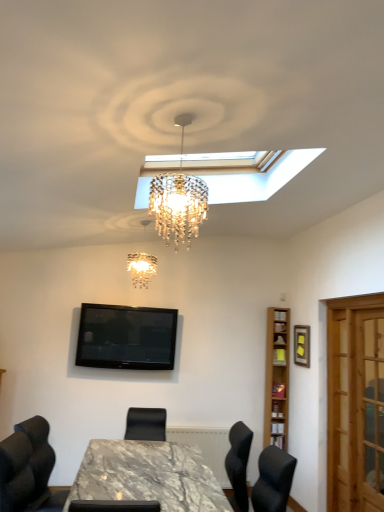
Describe the element at coordinates (355, 403) in the screenshot. This screenshot has width=384, height=512. I see `wooden screen door at right` at that location.

Find the location of a particular element. wooden screen door at right is located at coordinates (355, 403).

What are the coordinates of `marble table at center` in the screenshot? It's located at (148, 476).

Identify the location of wooden screen door at right. This screenshot has width=384, height=512. (355, 403).

In terms of height, does black glossy tv at upper center look taller or shorter compared to wooden screen door at right?

Clearly, black glossy tv at upper center is shorter compared to wooden screen door at right.

From the image's perspective, which is below, black glossy tv at upper center or wooden screen door at right?

wooden screen door at right.

Locate an element on the screen. television that is above the wooden screen door at right (from the image's perspective) is located at coordinates click(126, 337).

Considering the positions of objects black glossy tv at upper center and wooden screen door at right in the image provided, who is more to the right, black glossy tv at upper center or wooden screen door at right?

wooden screen door at right is more to the right.

Locate an element on the screen. The height and width of the screenshot is (512, 384). screen door located below the light brown wooden bookshelf at right (from the image's perspective) is located at coordinates (355, 403).

Based on their sizes in the image, would you say light brown wooden bookshelf at right is bigger or smaller than wooden screen door at right?

light brown wooden bookshelf at right is smaller than wooden screen door at right.

Is point (275, 398) behind point (357, 403)?

Yes, it is.

Consider the image. Does wooden screen door at right have a lesser height compared to black glossy tv at upper center?

In fact, wooden screen door at right may be taller than black glossy tv at upper center.

Does wooden screen door at right appear on the left side of black glossy tv at upper center?

→ Incorrect, wooden screen door at right is not on the left side of black glossy tv at upper center.

Can we say wooden screen door at right lies outside black glossy tv at upper center?

Yes, wooden screen door at right is not within black glossy tv at upper center.

From the image's perspective, between wooden screen door at right and black glossy tv at upper center, who is located below?

wooden screen door at right, from the image's perspective.

At what (x,y) coordinates should I click in order to perform the action: click on lamp behind the wooden screen door at right. Please return your answer as a coordinate pair (x, y). Looking at the image, I should click on (141, 268).

Between crystal chandelier at center and wooden screen door at right, which one is positioned in front?

wooden screen door at right is more forward.

Looking at this image, which object is thinner, crystal chandelier at center or wooden screen door at right?

With smaller width is wooden screen door at right.

Would you consider crystal chandelier at center to be distant from wooden screen door at right?

Yes.

Is there a large distance between crystal chandelier at center and light brown wooden bookshelf at right?

crystal chandelier at center is positioned a significant distance from light brown wooden bookshelf at right.

Can you confirm if crystal chandelier at center is bigger than light brown wooden bookshelf at right?

Yes, crystal chandelier at center is bigger than light brown wooden bookshelf at right.

This screenshot has height=512, width=384. I want to click on lamp lying on the left of light brown wooden bookshelf at right, so click(141, 268).

Is point (151, 273) positioned behind point (266, 377)?

No, (151, 273) is in front of (266, 377).

Which of these two, crystal chandelier at center or wooden picture frame at upper right, is smaller?

Smaller between the two is wooden picture frame at upper right.

Considering the positions of objects crystal chandelier at center and wooden picture frame at upper right in the image provided, who is more to the right, crystal chandelier at center or wooden picture frame at upper right?

wooden picture frame at upper right.

Is crystal chandelier at center directly adjacent to wooden picture frame at upper right?

No, crystal chandelier at center is not with wooden picture frame at upper right.

Does crystal chandelier at center contain wooden picture frame at upper right?

No, wooden picture frame at upper right is located outside of crystal chandelier at center.

How far apart are marble table at center and wooden picture frame at upper right?

marble table at center is 6.81 feet from wooden picture frame at upper right.

Is marble table at center to the right of wooden picture frame at upper right from the viewer's perspective?

Incorrect, marble table at center is not on the right side of wooden picture frame at upper right.

From the image's perspective, is marble table at center on wooden picture frame at upper right?

Actually, marble table at center appears below wooden picture frame at upper right in the image.

Which object is closer to the camera, marble table at center or wooden picture frame at upper right?

marble table at center is more forward.

Where is `screen door to the right of black glossy tv at upper center`? Image resolution: width=384 pixels, height=512 pixels. screen door to the right of black glossy tv at upper center is located at coordinates (x=355, y=403).

You are a GUI agent. You are given a task and a screenshot of the screen. Output one action in this format:
    pyautogui.click(x=<x>, y=<y>)
    Task: Click on the screen door below the light brown wooden bookshelf at right (from a real-world perspective)
    
    Given the screenshot: What is the action you would take?
    pyautogui.click(x=355, y=403)

Based on their spatial positions, is marble table at center or wooden screen door at right closer to black glossy tv at upper center?

marble table at center is positioned closer to the anchor black glossy tv at upper center.

When comparing their distances from light brown wooden bookshelf at right, does marble table at center or crystal chandelier at center seem further?

marble table at center.

From the image, which object appears to be farther from wooden picture frame at upper right, crystal chandelier at center or black glossy tv at upper center?

crystal chandelier at center.

Estimate the real-world distances between objects in this image. Which object is further from crystal chandelier at center, black glossy tv at upper center or light brown wooden bookshelf at right?

The object further to crystal chandelier at center is light brown wooden bookshelf at right.

Looking at the image, which one is located closer to wooden screen door at right, black glossy tv at upper center or crystal chandelier at center?

The object closer to wooden screen door at right is black glossy tv at upper center.

From the image, which object appears to be nearer to wooden picture frame at upper right, light brown wooden bookshelf at right or wooden screen door at right?

light brown wooden bookshelf at right is closer to wooden picture frame at upper right.

Estimate the real-world distances between objects in this image. Which object is further from crystal chandelier at center, wooden screen door at right or light brown wooden bookshelf at right?

wooden screen door at right.

When comparing their distances from crystal chandelier at center, does wooden screen door at right or marble table at center seem further?

The object further to crystal chandelier at center is wooden screen door at right.

Identify the location of lamp between marble table at center and black glossy tv at upper center in the front-back direction. (141, 268).

This screenshot has height=512, width=384. I want to click on table situated between crystal chandelier at center and wooden screen door at right from left to right, so click(x=148, y=476).

What are the coordinates of `bookshelf between crystal chandelier at center and wooden screen door at right in the horizontal direction` in the screenshot? It's located at (277, 378).

The height and width of the screenshot is (512, 384). I want to click on lamp between marble table at center and light brown wooden bookshelf at right from front to back, so tap(141, 268).